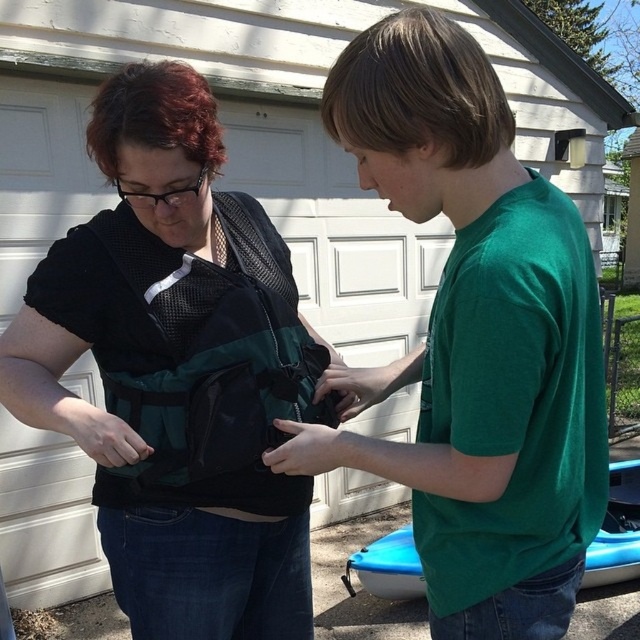
You are a photographer standing in front of the garage door. You want to take a photo of both the matte black vest at center and the green matte shirt at center. Which one will appear closer to the camera in the photo?

The matte black vest at center will appear closer to the camera in the photo because the green matte shirt at center is behind it.

You are a photographer trying to capture a closeup of the matte black vest at center. Based on its 2D coordinates, where should you position your camera relative to the image frame?

The matte black vest at center is located at point 0.583 on the x axis and 0.278 on the y axis. To capture a closeup, position the camera directly facing the center point of the image frame, slightly towards the right and lower middle areas to align with the coordinates provided.

You are a photographer trying to capture the matte black vest at center. The vest is located at point (177, 372). You have a camera with a zoom lens that can focus on objects within a radius of 0.1 units from the center point. Will the vest be in focus?

The matte black vest at center is located at point (177, 372). Since the camera can focus within a radius of 0.1 units from the center point, the vest will be in focus as it is exactly at the center point.